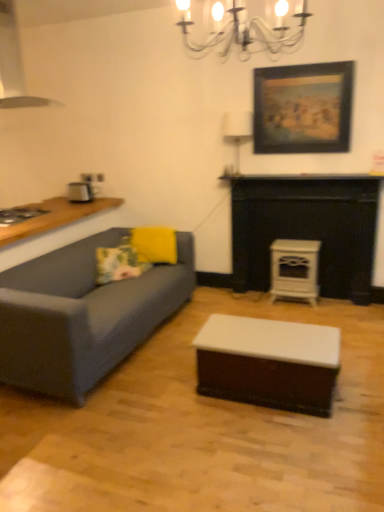
The image size is (384, 512). Identify the location of vacant area on top of white glossy fireplace at center (from a real-world perspective). (309, 178).